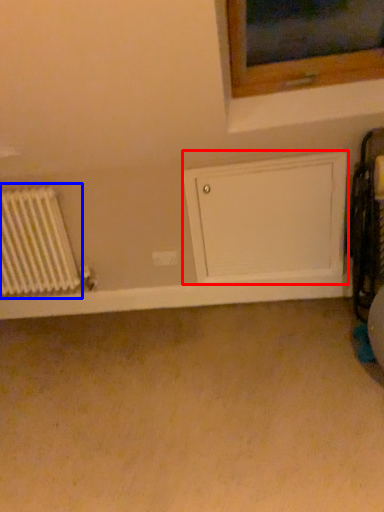
Question: Which object is closer to the camera taking this photo, wide (highlighted by a red box) or radiator (highlighted by a blue box)?

Choices:
 (A) wide
 (B) radiator

Answer: (A)